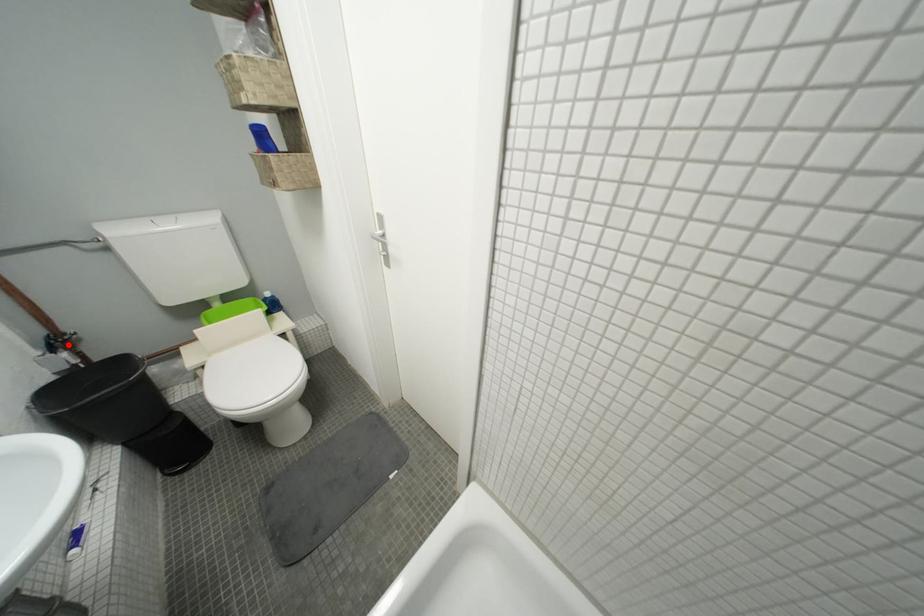
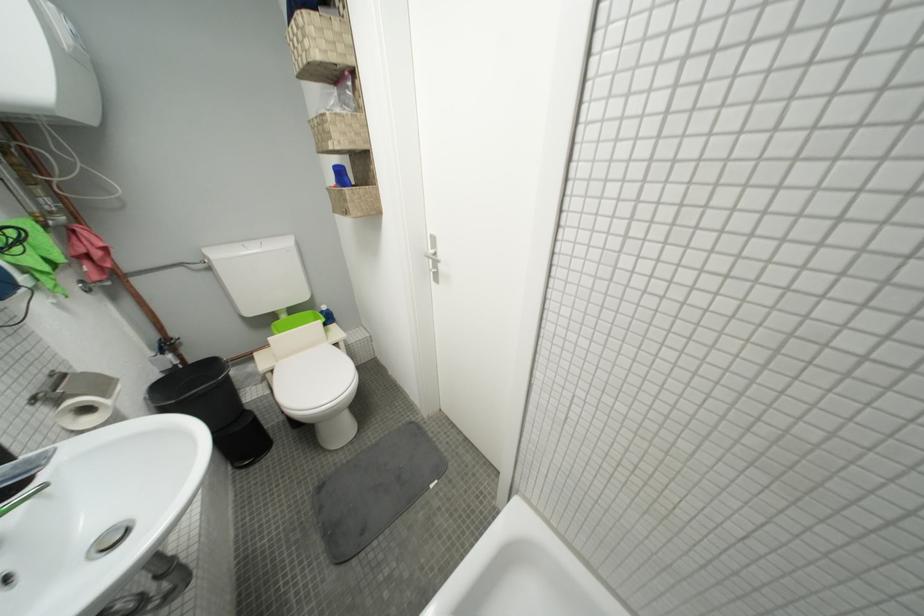
Where in the second image is the point corresponding to the highlighted location from the first image?

(175, 347)